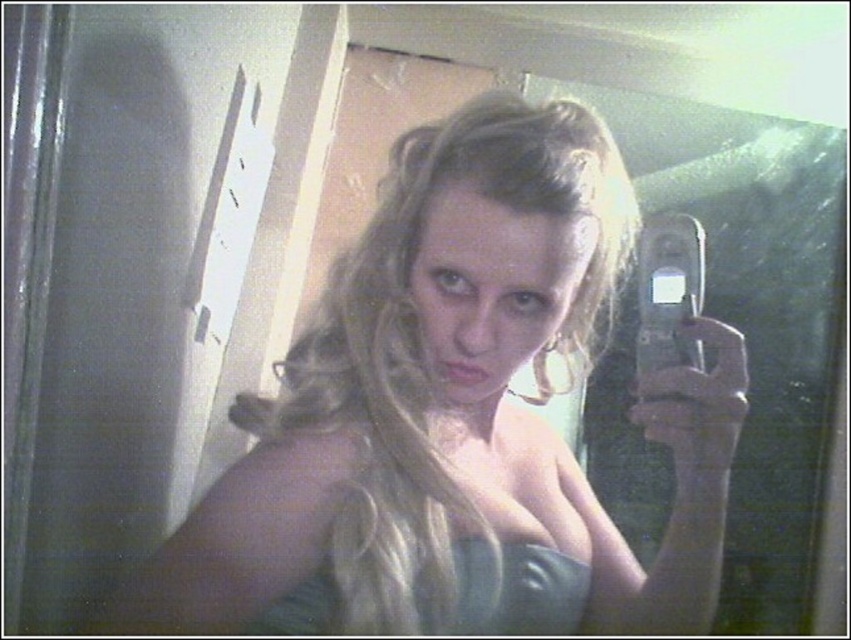
Question: Is matte blue dress at center to the left of satin blue dress at center from the viewer's perspective?

Choices:
 (A) no
 (B) yes

Answer: (B)

Question: Can you confirm if matte blue dress at center is positioned to the left of satin blue dress at center?

Choices:
 (A) no
 (B) yes

Answer: (B)

Question: Which of the following is the farthest from the observer?

Choices:
 (A) matte blue dress at center
 (B) satin blue dress at center

Answer: (B)

Question: Can you confirm if matte blue dress at center is positioned below satin blue dress at center?

Choices:
 (A) no
 (B) yes

Answer: (A)

Question: Which of the following is the farthest from the observer?

Choices:
 (A) satin blue dress at center
 (B) matte blue dress at center

Answer: (A)